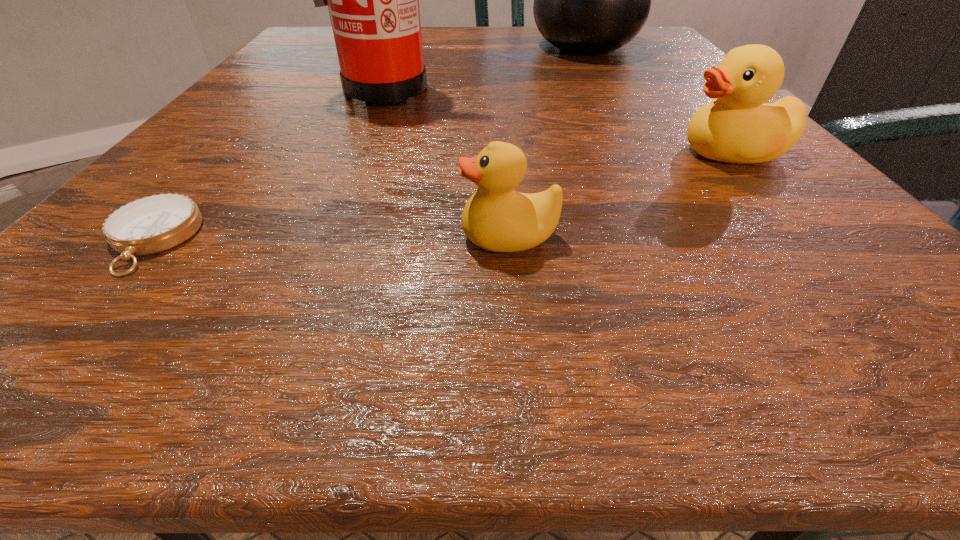
The height and width of the screenshot is (540, 960). In order to click on fire extinguisher that is positioned at the left edge in this screenshot , I will do `click(373, 0)`.

Locate an element on the screen. This screenshot has width=960, height=540. compass located in the left edge section of the desktop is located at coordinates (152, 224).

You are a GUI agent. You are given a task and a screenshot of the screen. Output one action in this format:
    pyautogui.click(x=<x>, y=<y>)
    Task: Click on the vase that is at the right edge
    Image resolution: width=960 pixels, height=540 pixels.
    Given the screenshot: What is the action you would take?
    pyautogui.click(x=590, y=0)

This screenshot has height=540, width=960. I want to click on duck that is at the right edge, so click(x=738, y=127).

Identify the location of object present at the far right corner. (590, 0).

Identify the location of vacant area at the far edge of the desktop. This screenshot has height=540, width=960. (507, 33).

Where is `vacant area at the near edge`? The height and width of the screenshot is (540, 960). vacant area at the near edge is located at coordinates pos(444,302).

The width and height of the screenshot is (960, 540). I want to click on vacant space at the left edge of the desktop, so click(x=215, y=122).

Where is `free space at the right edge of the desktop`? Image resolution: width=960 pixels, height=540 pixels. free space at the right edge of the desktop is located at coordinates (693, 103).

Identify the location of free point at the far right corner. The image size is (960, 540). (674, 52).